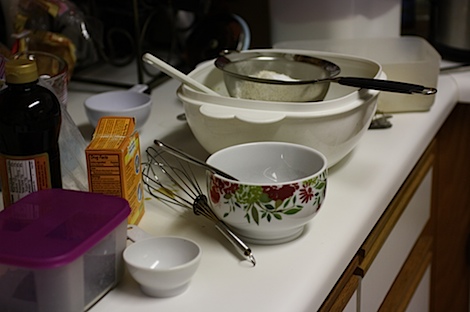
Where is `cabinet`? The height and width of the screenshot is (312, 470). cabinet is located at coordinates (409, 290).